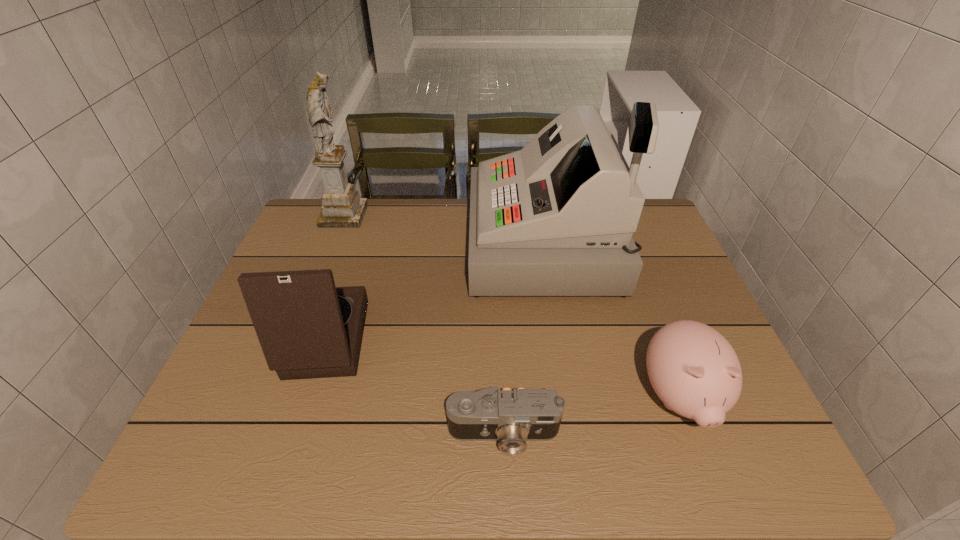
Locate an element on the screen. The height and width of the screenshot is (540, 960). empty location between the piggy bank and the sculpture is located at coordinates (512, 307).

At what (x,y) coordinates should I click in order to perform the action: click on empty space that is in between the shortest object and the phonograph record. Please return your answer as a coordinate pair (x, y). Looking at the image, I should click on (408, 387).

At what (x,y) coordinates should I click in order to perform the action: click on unoccupied position between the camera and the piggy bank. Please return your answer as a coordinate pair (x, y). The image size is (960, 540). Looking at the image, I should click on (591, 416).

You are a GUI agent. You are given a task and a screenshot of the screen. Output one action in this format:
    pyautogui.click(x=<x>, y=<y>)
    Task: Click on the vacant space that is in between the cash register and the shortest object
    
    Given the screenshot: What is the action you would take?
    pyautogui.click(x=524, y=339)

I want to click on free area in between the piggy bank and the cash register, so click(612, 321).

You are a GUI agent. You are given a task and a screenshot of the screen. Output one action in this format:
    pyautogui.click(x=<x>, y=<y>)
    Task: Click on the object that is the second closest to the piggy bank
    
    Given the screenshot: What is the action you would take?
    pyautogui.click(x=512, y=417)

Where is `object that is the third closest to the phonograph record`? The height and width of the screenshot is (540, 960). object that is the third closest to the phonograph record is located at coordinates (342, 207).

Image resolution: width=960 pixels, height=540 pixels. I want to click on free location that satisfies the following two spatial constraints: 1. on the keypad side of the cash register; 2. on the lens of the camera, so click(577, 434).

Locate an element on the screen. The image size is (960, 540). free location that satisfies the following two spatial constraints: 1. on the front-facing side of the sculpture; 2. on the back side of the phonograph record is located at coordinates (295, 340).